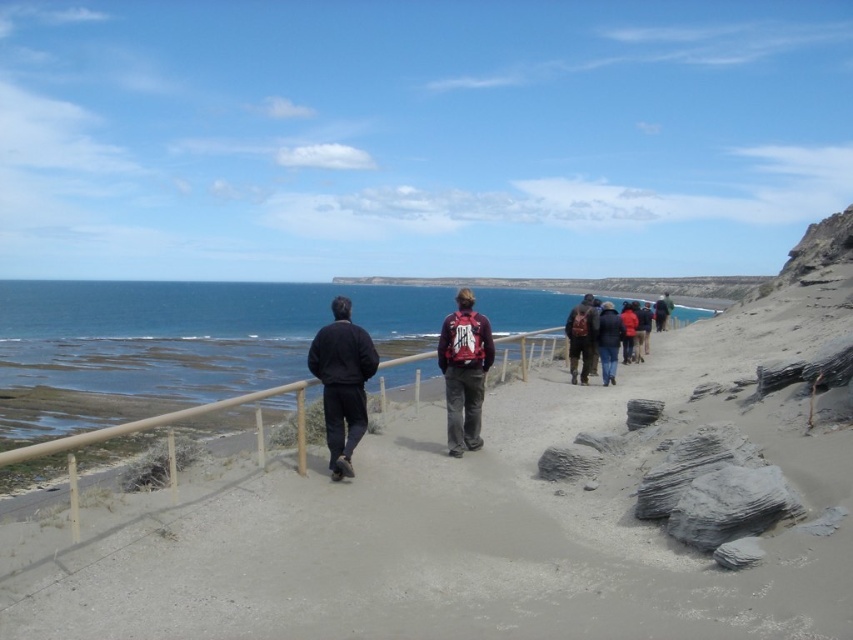
You are standing at the origin point of the image coordinate system, where the bottom left corner is considered as the origin. The dark blue jacket at center is located at point 0.598, 0.402. If you want to walk towards the jacket, which direction should you move in terms of x and y coordinates?

To reach the dark blue jacket at center located at coordinates 0.598 in the x direction and 0.402 in the y direction, you should move towards increasing x and increasing y directions since both coordinates are greater than zero.

You are standing on the coastal path and want to walk towards the two points marked in the image. Which point, point (590, 326) or point (602, 355), will you reach first?

Point (590, 326) is closer to the viewer than point (602, 355), so you will reach point (590, 326) first.

You are standing on the coastal path and want to take a photo of the dark blue jacket at center and the dark brown backpack at center. Which object should you focus on first to ensure both are in the frame?

You should focus on the dark blue jacket at center first since it is closer to the viewer than the dark brown backpack at center, ensuring both are in the frame.